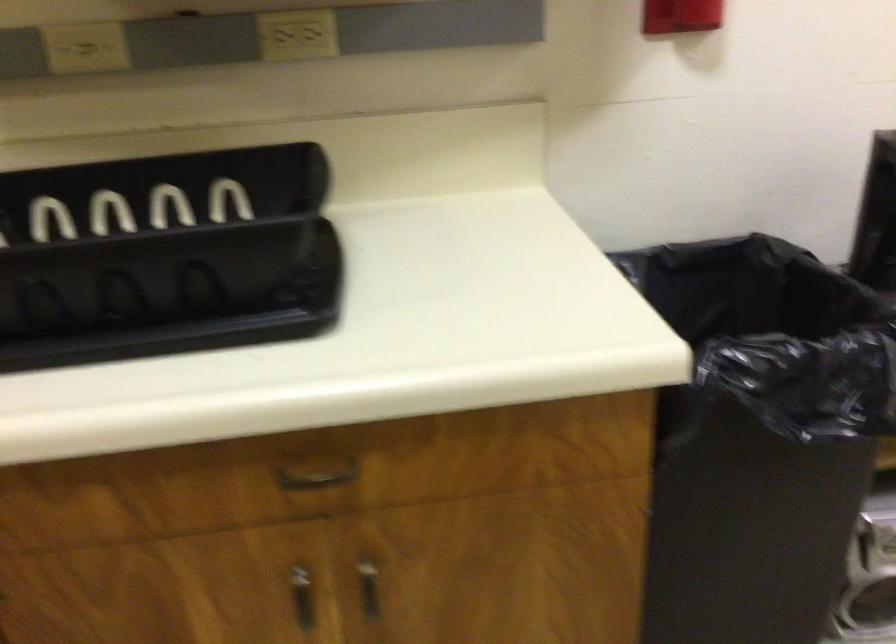
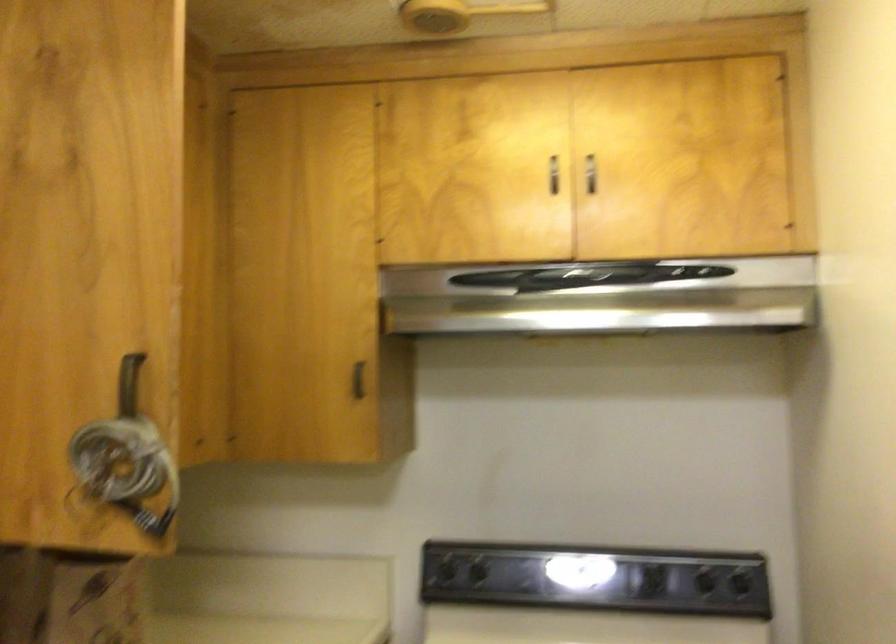
Question: The camera is either moving clockwise (left) or counter-clockwise (right) around the object. The first image is from the beginning of the video and the second image is from the end. Is the camera moving left or right when shooting the video?

Choices:
 (A) Left
 (B) Right

Answer: (B)